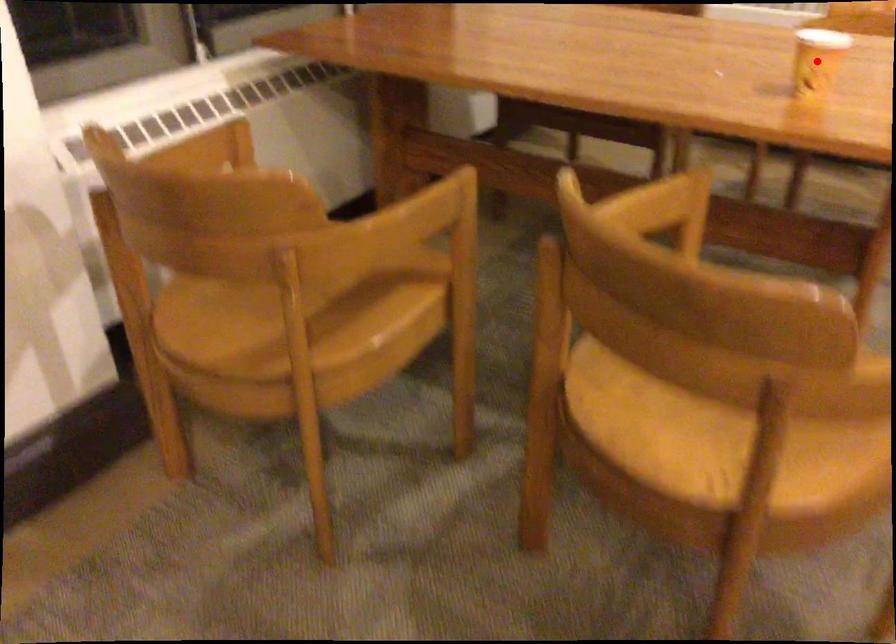
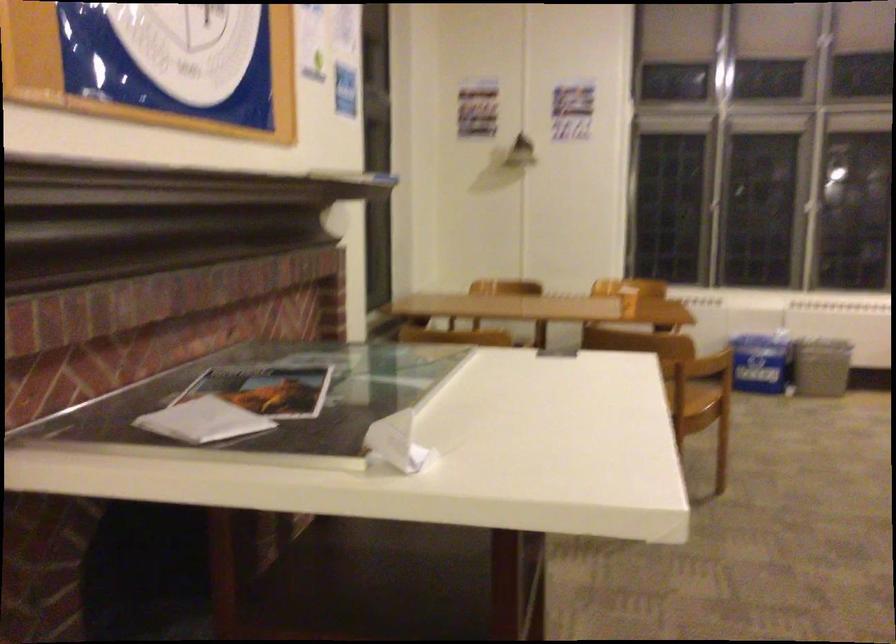
Question: I am providing you with two images of the same scene from different viewpoints. A red point is marked on the first image. Is the red point's position out of view in image 2?

Choices:
 (A) Yes
 (B) No

Answer: (A)